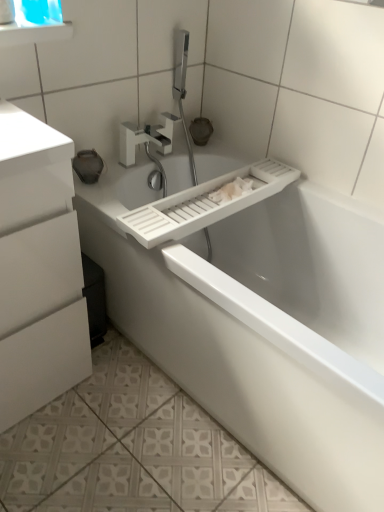
Question: Considering the relative sizes of white plastic bathtub at center and white glossy cabinet at left in the image provided, is white plastic bathtub at center wider than white glossy cabinet at left?

Choices:
 (A) no
 (B) yes

Answer: (B)

Question: Considering the relative sizes of white plastic bathtub at center and white glossy cabinet at left in the image provided, is white plastic bathtub at center shorter than white glossy cabinet at left?

Choices:
 (A) yes
 (B) no

Answer: (A)

Question: Considering the relative sizes of white plastic bathtub at center and white glossy cabinet at left in the image provided, is white plastic bathtub at center taller than white glossy cabinet at left?

Choices:
 (A) yes
 (B) no

Answer: (B)

Question: Could you tell me if white plastic bathtub at center is turned towards white glossy cabinet at left?

Choices:
 (A) no
 (B) yes

Answer: (B)

Question: Are white plastic bathtub at center and white glossy cabinet at left far apart?

Choices:
 (A) yes
 (B) no

Answer: (B)

Question: Is white glossy cabinet at left spatially inside transparent plastic medicine cabinet at upper left, or outside of it?

Choices:
 (A) outside
 (B) inside

Answer: (A)

Question: From the image's perspective, relative to transparent plastic medicine cabinet at upper left, is white glossy cabinet at left above or below?

Choices:
 (A) below
 (B) above

Answer: (A)

Question: Considering the positions of white glossy cabinet at left and transparent plastic medicine cabinet at upper left in the image, is white glossy cabinet at left taller or shorter than transparent plastic medicine cabinet at upper left?

Choices:
 (A) short
 (B) tall

Answer: (B)

Question: Is white glossy cabinet at left in front of or behind transparent plastic medicine cabinet at upper left in the image?

Choices:
 (A) behind
 (B) front

Answer: (B)

Question: Considering the positions of point (332, 336) and point (130, 142), is point (332, 336) closer or farther from the camera than point (130, 142)?

Choices:
 (A) closer
 (B) farther

Answer: (B)

Question: Considering the relative positions of white plastic bathtub at center and white matte tap at upper center in the image provided, is white plastic bathtub at center to the left or to the right of white matte tap at upper center?

Choices:
 (A) left
 (B) right

Answer: (B)

Question: Relative to white matte tap at upper center, is white plastic bathtub at center in front or behind?

Choices:
 (A) behind
 (B) front

Answer: (B)

Question: Choose the correct answer: Is white plastic bathtub at center inside white matte tap at upper center or outside it?

Choices:
 (A) inside
 (B) outside

Answer: (B)

Question: Considering the positions of white glossy cabinet at left and white plastic sink at upper center in the image, is white glossy cabinet at left wider or thinner than white plastic sink at upper center?

Choices:
 (A) wide
 (B) thin

Answer: (A)

Question: Considering their positions, is white glossy cabinet at left located in front of or behind white plastic sink at upper center?

Choices:
 (A) front
 (B) behind

Answer: (A)